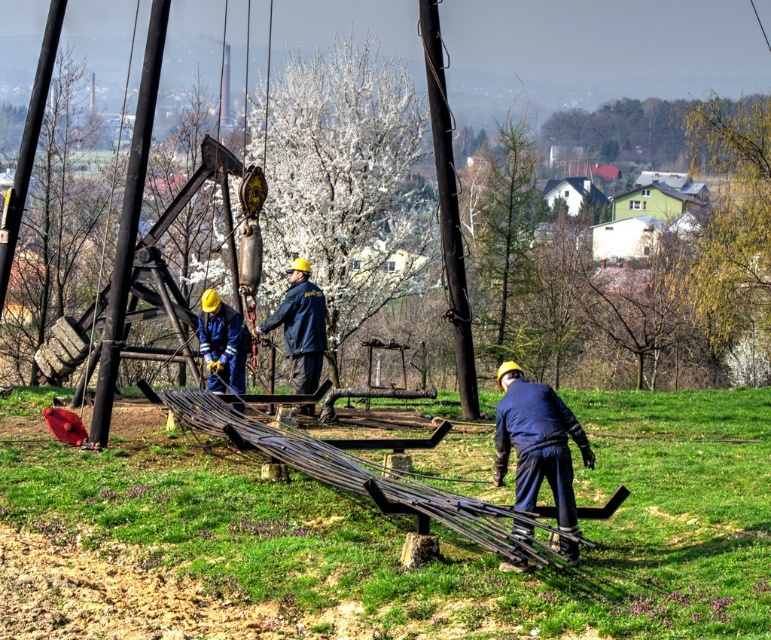
Question: Can you confirm if blue fabric worker at lower right is thinner than blue fabric worker at center?

Choices:
 (A) yes
 (B) no

Answer: (B)

Question: Which of these objects is positioned farthest from the blue fabric jacket at center?

Choices:
 (A) blue fabric worker at center
 (B) blue fabric worker at lower right

Answer: (B)

Question: In this image, where is blue fabric worker at lower right located relative to blue fabric jacket at center?

Choices:
 (A) left
 (B) right

Answer: (B)

Question: Which object appears farthest from the camera in this image?

Choices:
 (A) blue fabric jacket at center
 (B) blue fabric worker at lower right

Answer: (A)

Question: Among these points, which one is farthest from the camera?

Choices:
 (A) pos(322,316)
 (B) pos(527,404)
 (C) pos(204,296)

Answer: (A)

Question: Observing the image, what is the correct spatial positioning of blue fabric worker at lower right in reference to blue fabric worker at center?

Choices:
 (A) right
 (B) left

Answer: (A)